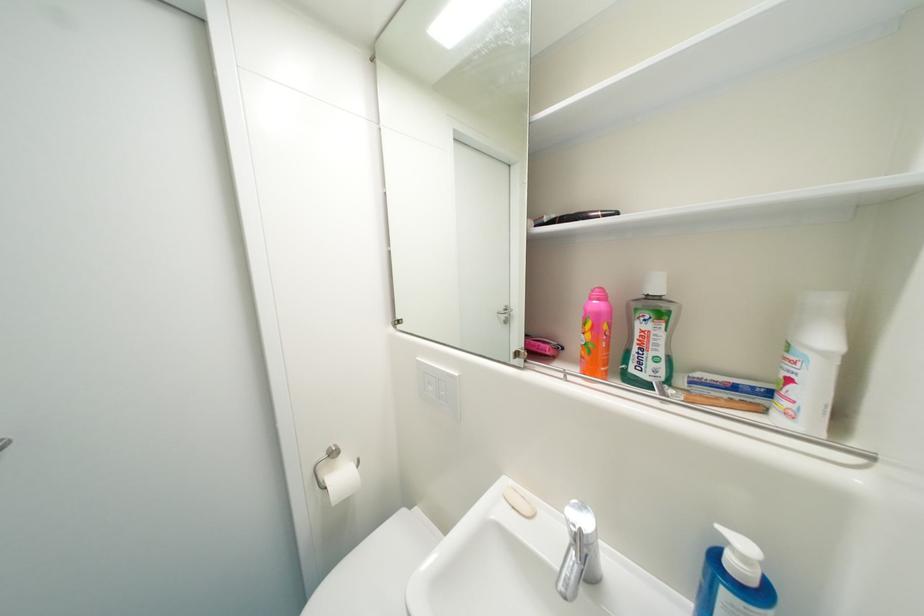
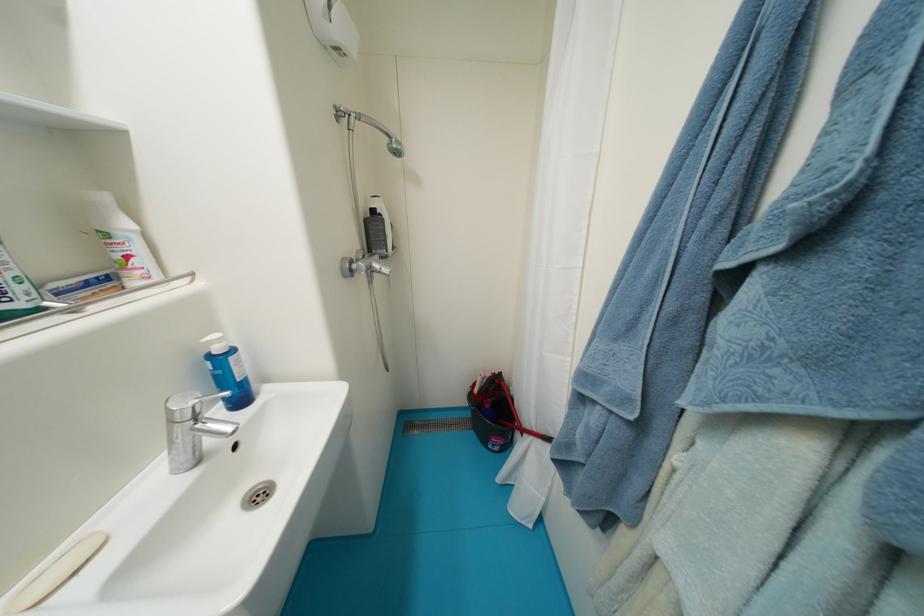
Where in the second image is the point corresponding to [796,382] from the first image?

(134, 259)